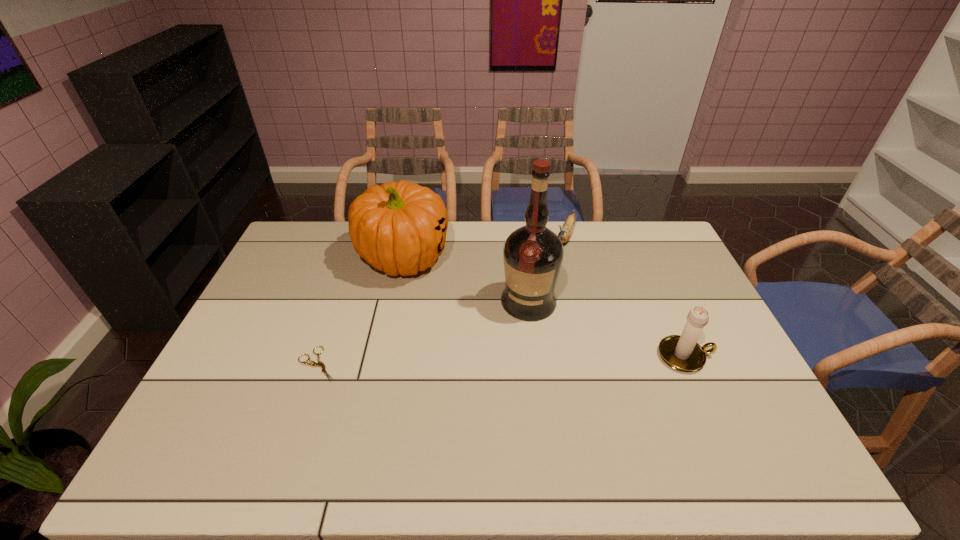
I want to click on free space on the desktop that is between the shears and the third tallest object and is positioned on the surface of the third object from left to right, so click(506, 360).

What are the coordinates of `free space on the desktop that is between the shears and the candle holder and is positioned at the stem of the fourth object from left to right` in the screenshot? It's located at (504, 360).

Find the location of a particular element. vacant space on the desktop that is between the shortest object and the candle holder and is positioned on the surface of the pumpkin is located at coordinates (453, 361).